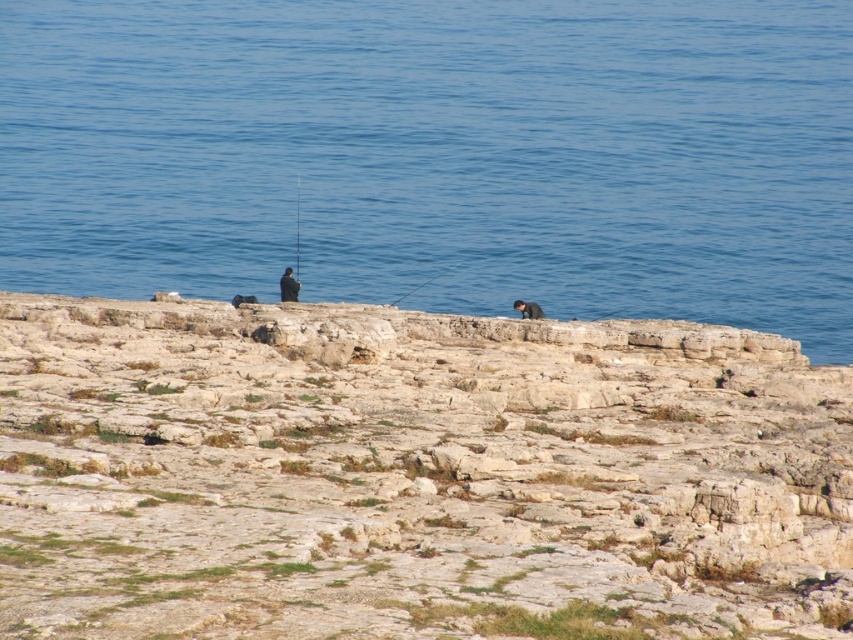
Can you confirm if rough stone hillside at center is wider than blue water at center?

In fact, rough stone hillside at center might be narrower than blue water at center.

Does point (723, 385) come in front of point (480, 10)?

That is True.

You are a GUI agent. You are given a task and a screenshot of the screen. Output one action in this format:
    pyautogui.click(x=<x>, y=<y>)
    Task: Click on the rough stone hillside at center
    
    Given the screenshot: What is the action you would take?
    pyautogui.click(x=413, y=474)

Is the position of dark blue fabric jacket at center more distant than that of black plastic fishing pole at center?

That is False.

From the picture: Who is taller, dark blue fabric jacket at center or black plastic fishing pole at center?

black plastic fishing pole at center

Who is more distant from viewer, (291, 292) or (299, 188)?

Point (299, 188)

Find the location of a particular element. dark blue fabric jacket at center is located at coordinates (288, 285).

Between blue water at center and black plastic fishing pole at center, which one is positioned lower?

black plastic fishing pole at center

Between blue water at center and black plastic fishing pole at center, which one is positioned higher?

blue water at center is higher up.

Where is `blue water at center`? The width and height of the screenshot is (853, 640). blue water at center is located at coordinates (438, 156).

Find the location of a particular element. blue water at center is located at coordinates (438, 156).